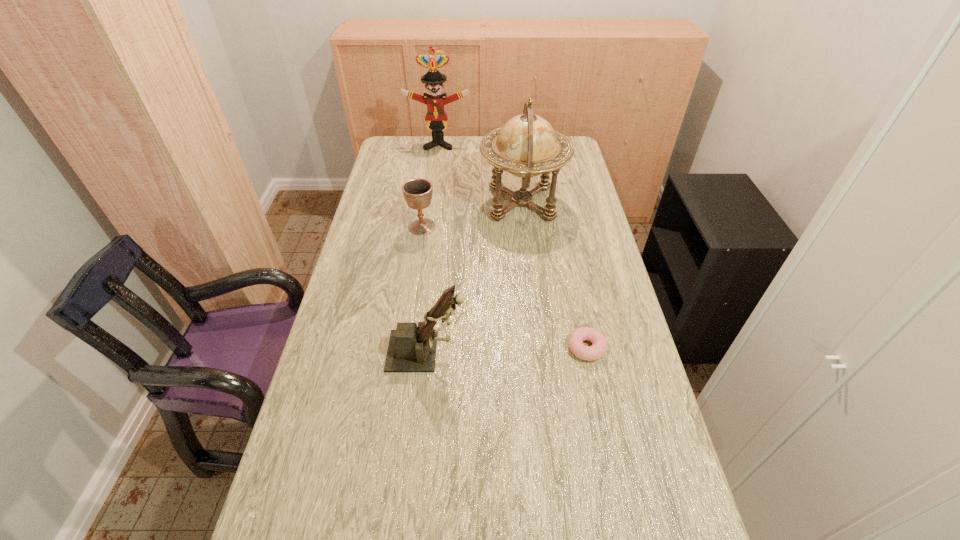
Where is `nutcracker`? The width and height of the screenshot is (960, 540). nutcracker is located at coordinates (436, 116).

In order to click on globe in this screenshot , I will do `click(526, 146)`.

The image size is (960, 540). Find the location of `figurine`. figurine is located at coordinates (411, 349).

Find the location of a particular element. This screenshot has height=540, width=960. the second shortest object is located at coordinates pos(418,192).

The width and height of the screenshot is (960, 540). I want to click on doughnut, so click(575, 340).

You are a GUI agent. You are given a task and a screenshot of the screen. Output one action in this format:
    pyautogui.click(x=<x>, y=<y>)
    Task: Click on the free point located 0.300m on the front-facing side of the farthest object
    
    Given the screenshot: What is the action you would take?
    pyautogui.click(x=433, y=190)

You are a GUI agent. You are given a task and a screenshot of the screen. Output one action in this format:
    pyautogui.click(x=<x>, y=<y>)
    Task: Click on the vacant space located 0.310m on the front-facing side of the globe
    This screenshot has height=540, width=960.
    Given the screenshot: What is the action you would take?
    pyautogui.click(x=396, y=203)

You are a GUI agent. You are given a task and a screenshot of the screen. Output one action in this format:
    pyautogui.click(x=<x>, y=<y>)
    Task: Click on the free region located 0.170m on the front-facing side of the globe
    The height and width of the screenshot is (540, 960).
    Given the screenshot: What is the action you would take?
    click(434, 203)

Locate an element on the screen. vacant space located 0.140m on the front-facing side of the globe is located at coordinates (443, 203).

Find the location of a particular element. vacant space located on the front-facing side of the figurine is located at coordinates (516, 351).